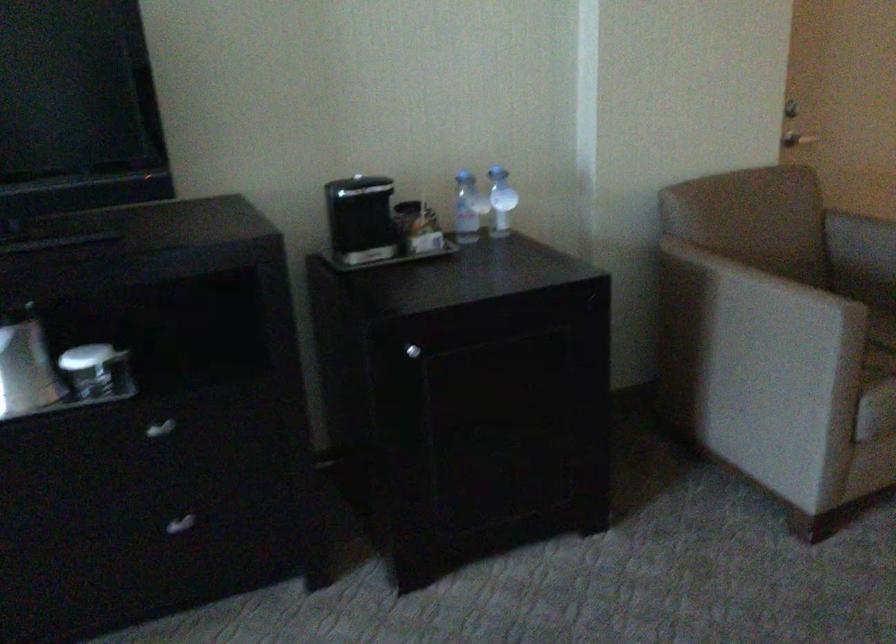
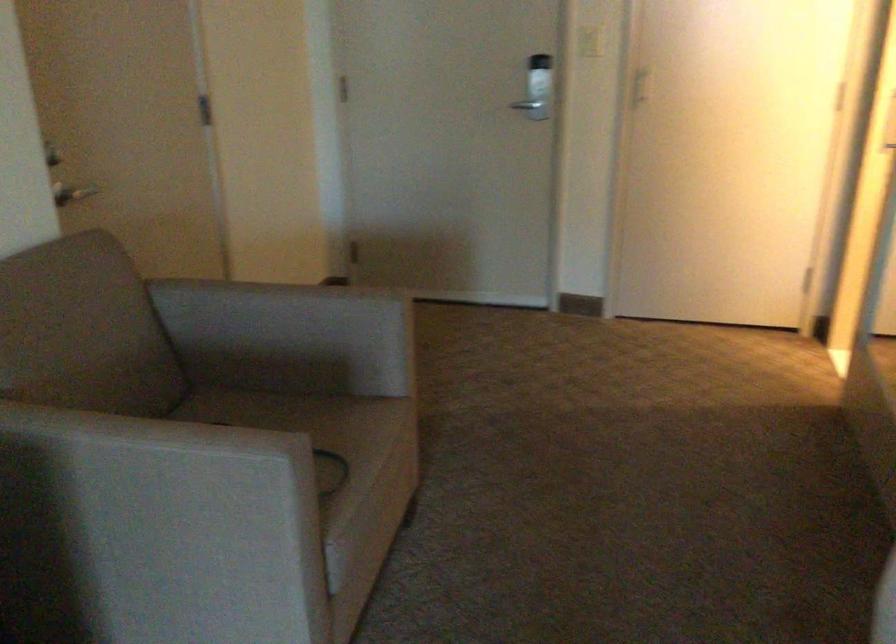
Question: Based on the continuous images, in which direction is the camera rotating? Reply with the corresponding letter.

Choices:
 (A) Left
 (B) Right
 (C) Up
 (D) Down

Answer: (B)